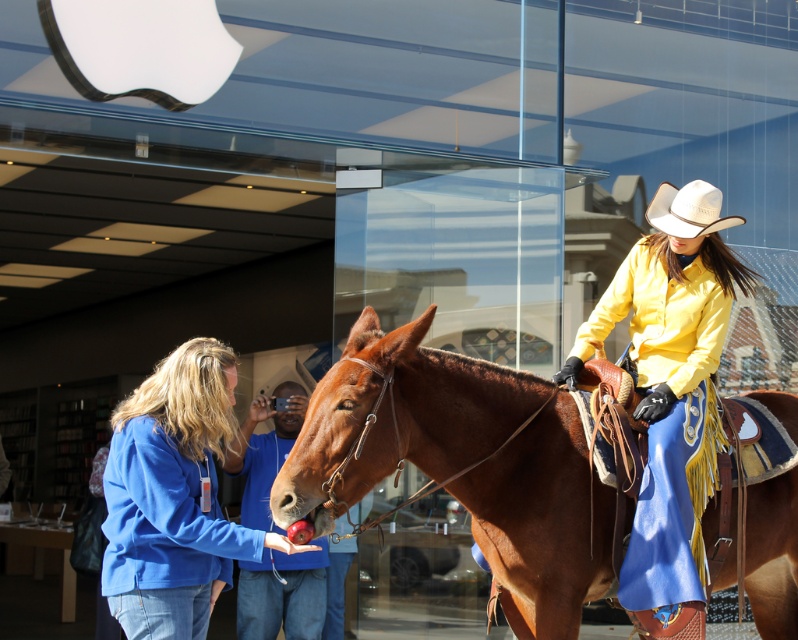
From the picture: You are a delivery person who needs to place a 5 feet long box between the brown leather horse at center and the white felt cowboy hat at upper right. Can you fit the box between them without overlapping either object?

The distance between the brown leather horse at center and the white felt cowboy hat at upper right is 4.85 feet. Since the box is 5 feet long, it cannot fit between them without overlapping either object.

You are standing in front of the Apple Store and want to find the blue cotton jacket at center. Where should you look?

The blue cotton jacket at center is located at the coordinates point [174,497].